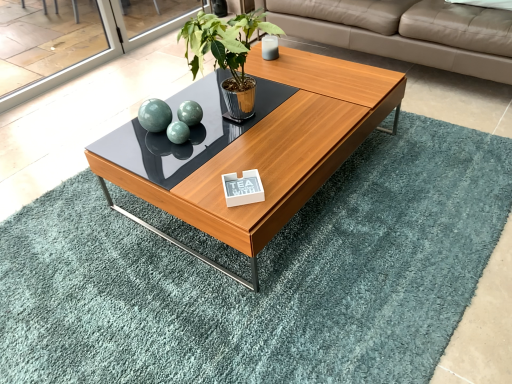
What do you see at coordinates (263, 277) in the screenshot? I see `teal rug at center` at bounding box center [263, 277].

What is the approximate width of green leafy plant at center?

13.89 inches.

Measure the distance between wooden coffee table at center and camera.

They are 1.26 meters apart.

You are a GUI agent. You are given a task and a screenshot of the screen. Output one action in this format:
    pyautogui.click(x=<x>, y=<y>)
    Task: Click on the beige leather couch at upper right
    The width and height of the screenshot is (512, 384).
    Given the screenshot: What is the action you would take?
    pyautogui.click(x=407, y=32)

Is point (322, 32) in front of point (236, 111)?

No, it is not.

How much distance is there between beige leather couch at upper right and green leafy plant at center?

beige leather couch at upper right is 1.01 meters away from green leafy plant at center.

Is green leafy plant at center at the back of beige leather couch at upper right?

That's not correct — beige leather couch at upper right is not looking away from green leafy plant at center.

Is beige leather couch at upper right to the left or to the right of green leafy plant at center in the image?

From the image, it's evident that beige leather couch at upper right is to the right of green leafy plant at center.

Which object is further away from the camera taking this photo, white glossy plaque at center or green leafy plant at center?

white glossy plaque at center is behind.

Considering the sizes of objects white glossy plaque at center and green leafy plant at center in the image provided, who is wider, white glossy plaque at center or green leafy plant at center?

Wider between the two is green leafy plant at center.

Is white glossy plaque at center next to green leafy plant at center?

No, white glossy plaque at center is not in contact with green leafy plant at center.

Which is in front, point (236, 180) or point (237, 41)?

The point (236, 180) is more forward.

Is beige leather couch at upper right thinner than white glossy plaque at center?

In fact, beige leather couch at upper right might be wider than white glossy plaque at center.

From the image's perspective, which is below, beige leather couch at upper right or white glossy plaque at center?

white glossy plaque at center appears lower in the image.

Could white glossy plaque at center be considered to be inside beige leather couch at upper right?

No, beige leather couch at upper right does not contain white glossy plaque at center.

Which is behind, point (509, 33) or point (241, 200)?

Positioned behind is point (509, 33).

From the image's perspective, is teal rug at center beneath green leafy plant at center?

Yes.

Can green leafy plant at center be found inside teal rug at center?

Definitely not — green leafy plant at center is not inside teal rug at center.

Is teal rug at center not close to green leafy plant at center?

That's not correct — teal rug at center is a little close to green leafy plant at center.

Between teal rug at center and green leafy plant at center, which one has more height?

Standing taller between the two is green leafy plant at center.

Is wooden coffee table at center aimed at white glossy plaque at center?

No.

Is wooden coffee table at center taller than white glossy plaque at center?

Indeed, wooden coffee table at center has a greater height compared to white glossy plaque at center.

Is wooden coffee table at center wider or thinner than white glossy plaque at center?

Considering their sizes, wooden coffee table at center looks broader than white glossy plaque at center.

How different are the orientations of wooden coffee table at center and white glossy plaque at center in degrees?

42.7 degrees separate the facing orientations of wooden coffee table at center and white glossy plaque at center.

Considering the relative positions of green leafy plant at center and beige leather couch at upper right in the image provided, is green leafy plant at center to the right of beige leather couch at upper right from the viewer's perspective?

No.

From a real-world perspective, relative to beige leather couch at upper right, is green leafy plant at center vertically above or below?

In terms of real-world spatial position, green leafy plant at center is above beige leather couch at upper right.

From the image's perspective, who appears lower, green leafy plant at center or beige leather couch at upper right?

green leafy plant at center.

Can you confirm if green leafy plant at center is shorter than beige leather couch at upper right?

Yes.

Which object is more forward, wooden coffee table at center or beige leather couch at upper right?

wooden coffee table at center is more forward.

How different are the orientations of wooden coffee table at center and beige leather couch at upper right in degrees?

The angle between the facing direction of wooden coffee table at center and the facing direction of beige leather couch at upper right is 90.9 degrees.

Which is in front, point (270, 179) or point (505, 68)?

The point (270, 179) is closer to the camera.

You are a GUI agent. You are given a task and a screenshot of the screen. Output one action in this format:
    pyautogui.click(x=<x>, y=<y>)
    Task: Click on the studio couch lying on the right of wooden coffee table at center
    
    Given the screenshot: What is the action you would take?
    pyautogui.click(x=407, y=32)

This screenshot has height=384, width=512. I want to click on studio couch that is above the green leafy plant at center (from the image's perspective), so click(x=407, y=32).

Find the location of a particular element. plaque located behind the green leafy plant at center is located at coordinates (243, 188).

Considering their positions, is green leafy plant at center positioned further to white glossy plaque at center than teal rug at center?

teal rug at center.

Estimate the real-world distances between objects in this image. Which object is closer to wooden coffee table at center, beige leather couch at upper right or green leafy plant at center?

Among the two, green leafy plant at center is located nearer to wooden coffee table at center.

Based on the photo, based on their spatial positions, is beige leather couch at upper right or wooden coffee table at center further from teal rug at center?

beige leather couch at upper right.

Looking at the image, which one is located closer to green leafy plant at center, beige leather couch at upper right or wooden coffee table at center?

wooden coffee table at center.

From the image, which object appears to be nearer to teal rug at center, white glossy plaque at center or green leafy plant at center?

white glossy plaque at center.

Considering their positions, is white glossy plaque at center positioned further to wooden coffee table at center than beige leather couch at upper right?

beige leather couch at upper right.

Based on their spatial positions, is white glossy plaque at center or beige leather couch at upper right further from green leafy plant at center?

The object further to green leafy plant at center is beige leather couch at upper right.

From the image, which object appears to be farther from teal rug at center, wooden coffee table at center or beige leather couch at upper right?

beige leather couch at upper right is further to teal rug at center.

You are a GUI agent. You are given a task and a screenshot of the screen. Output one action in this format:
    pyautogui.click(x=<x>, y=<y>)
    Task: Click on the houseplant between beige leather couch at upper right and teal rug at center from top to bottom
    The height and width of the screenshot is (384, 512).
    Given the screenshot: What is the action you would take?
    pyautogui.click(x=227, y=54)

You are a GUI agent. You are given a task and a screenshot of the screen. Output one action in this format:
    pyautogui.click(x=<x>, y=<y>)
    Task: Click on the coffee table between beige leather couch at upper right and teal rug at center vertically
    This screenshot has height=384, width=512.
    Given the screenshot: What is the action you would take?
    pyautogui.click(x=274, y=151)

Where is `coffee table between teal rug at center and green leafy plant at center in the front-back direction`? Image resolution: width=512 pixels, height=384 pixels. coffee table between teal rug at center and green leafy plant at center in the front-back direction is located at coordinates (274, 151).

Locate an element on the screen. coffee table between beige leather couch at upper right and white glossy plaque at center in the up-down direction is located at coordinates (274, 151).